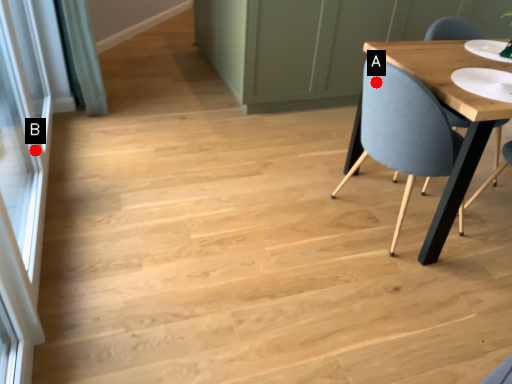
Question: Two points are circled on the image, labeled by A and B beside each circle. Which point is farther to the camera?

Choices:
 (A) A is further
 (B) B is further

Answer: (B)